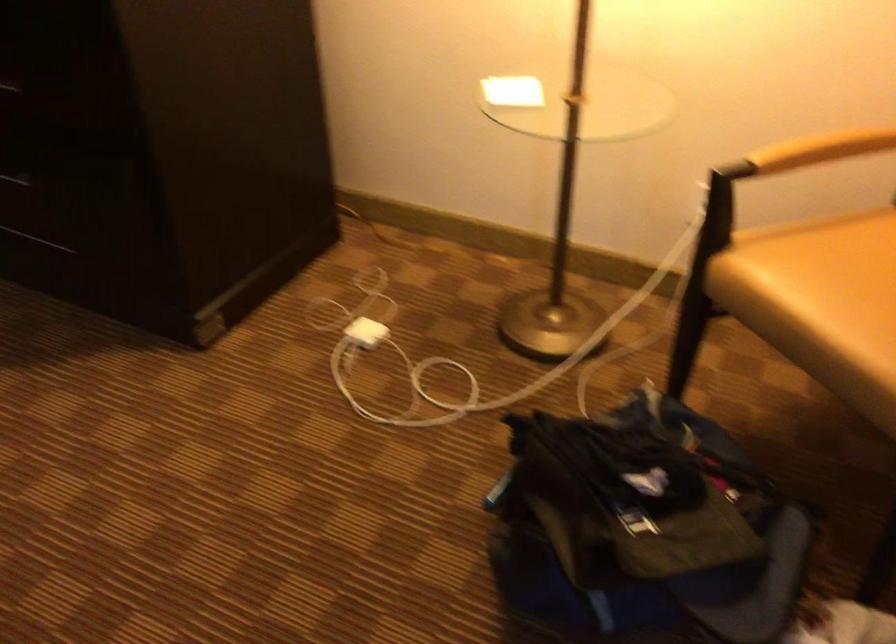
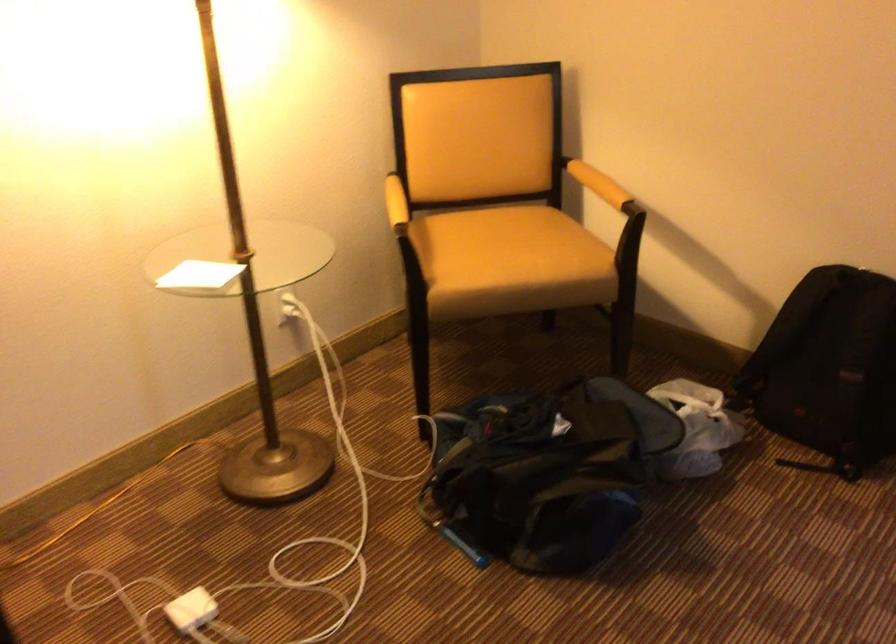
In the second image, find the point that corresponds to point (821, 149) in the first image.

(414, 199)